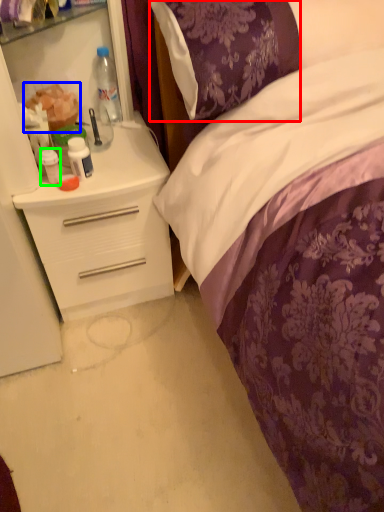
Question: Based on their relative distances, which object is farther from pillow (highlighted by a red box)? Choose from food (highlighted by a blue box) and bottle (highlighted by a green box).

Choices:
 (A) food
 (B) bottle

Answer: (B)